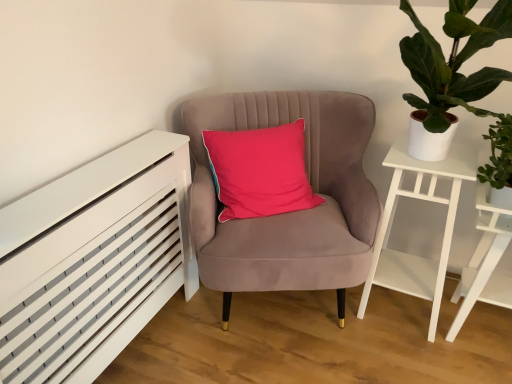
Identify the location of free region under white matte side table at right (from a real-world perspective). (402, 310).